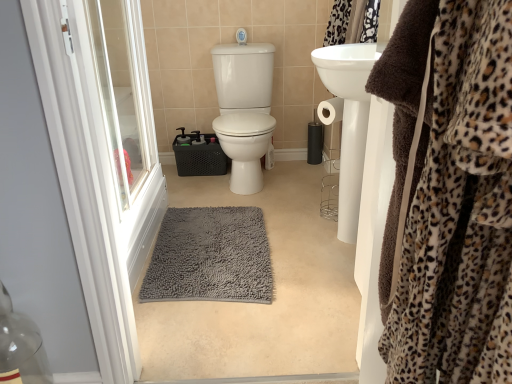
Question: Is brown plush robe at right to the left of white plastic screen door at left from the viewer's perspective?

Choices:
 (A) yes
 (B) no

Answer: (B)

Question: Is brown plush robe at right wider than white plastic screen door at left?

Choices:
 (A) yes
 (B) no

Answer: (B)

Question: Does brown plush robe at right lie in front of white plastic screen door at left?

Choices:
 (A) no
 (B) yes

Answer: (B)

Question: Is brown plush robe at right positioned behind white plastic screen door at left?

Choices:
 (A) yes
 (B) no

Answer: (B)

Question: Is brown plush robe at right facing away from white plastic screen door at left?

Choices:
 (A) no
 (B) yes

Answer: (A)

Question: Visually, is brown plush robe at right positioned to the left or to the right of gray shaggy bath mat at center?

Choices:
 (A) right
 (B) left

Answer: (A)

Question: From the image's perspective, is brown plush robe at right above or below gray shaggy bath mat at center?

Choices:
 (A) above
 (B) below

Answer: (A)

Question: Considering the positions of brown plush robe at right and gray shaggy bath mat at center in the image, is brown plush robe at right bigger or smaller than gray shaggy bath mat at center?

Choices:
 (A) big
 (B) small

Answer: (B)

Question: Do you think brown plush robe at right is within gray shaggy bath mat at center, or outside of it?

Choices:
 (A) outside
 (B) inside

Answer: (A)

Question: Is gray shaggy rug at center wider or thinner than white plastic screen door at left?

Choices:
 (A) wide
 (B) thin

Answer: (A)

Question: Is gray shaggy rug at center taller or shorter than white plastic screen door at left?

Choices:
 (A) tall
 (B) short

Answer: (B)

Question: Considering their positions, is gray shaggy rug at center located in front of or behind white plastic screen door at left?

Choices:
 (A) behind
 (B) front

Answer: (A)

Question: From the image's perspective, is gray shaggy rug at center positioned above or below white plastic screen door at left?

Choices:
 (A) above
 (B) below

Answer: (B)

Question: Visually, is white plastic screen door at left positioned to the left or to the right of gray shaggy bath mat at center?

Choices:
 (A) right
 (B) left

Answer: (B)

Question: From their relative heights in the image, would you say white plastic screen door at left is taller or shorter than gray shaggy bath mat at center?

Choices:
 (A) short
 (B) tall

Answer: (B)